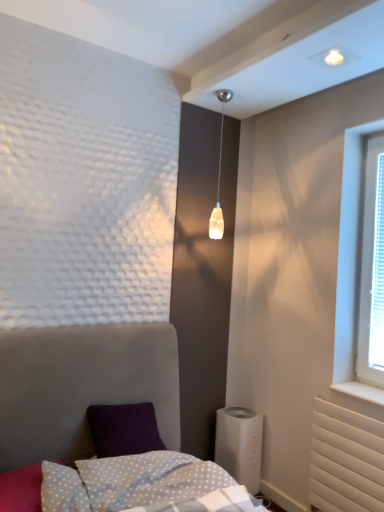
Question: Can you confirm if white dotted fabric at lower center is positioned to the right of velvet grey bed at lower left?

Choices:
 (A) no
 (B) yes

Answer: (A)

Question: Can you confirm if white dotted fabric at lower center is bigger than velvet grey bed at lower left?

Choices:
 (A) no
 (B) yes

Answer: (A)

Question: Can we say white dotted fabric at lower center lies outside velvet grey bed at lower left?

Choices:
 (A) no
 (B) yes

Answer: (A)

Question: Considering the relative sizes of white dotted fabric at lower center and velvet grey bed at lower left in the image provided, is white dotted fabric at lower center taller than velvet grey bed at lower left?

Choices:
 (A) yes
 (B) no

Answer: (B)

Question: Does white dotted fabric at lower center have a lesser height compared to velvet grey bed at lower left?

Choices:
 (A) yes
 (B) no

Answer: (A)

Question: Is white dotted fabric pillow at lower left in front of or behind velvet grey bed at lower left in the image?

Choices:
 (A) behind
 (B) front

Answer: (A)

Question: From the image's perspective, is white dotted fabric pillow at lower left located above or below velvet grey bed at lower left?

Choices:
 (A) above
 (B) below

Answer: (B)

Question: Is white dotted fabric pillow at lower left inside or outside of velvet grey bed at lower left?

Choices:
 (A) outside
 (B) inside

Answer: (B)

Question: In the image, is white dotted fabric pillow at lower left on the left side or the right side of velvet grey bed at lower left?

Choices:
 (A) right
 (B) left

Answer: (B)

Question: Considering the positions of velvet grey bed at lower left and white dotted fabric at lower center in the image, is velvet grey bed at lower left wider or thinner than white dotted fabric at lower center?

Choices:
 (A) thin
 (B) wide

Answer: (B)

Question: Is point (135, 369) closer or farther from the camera than point (77, 478)?

Choices:
 (A) closer
 (B) farther

Answer: (B)

Question: From the image's perspective, is velvet grey bed at lower left above or below white dotted fabric at lower center?

Choices:
 (A) below
 (B) above

Answer: (B)

Question: Considering the positions of velvet grey bed at lower left and white dotted fabric at lower center in the image, is velvet grey bed at lower left bigger or smaller than white dotted fabric at lower center?

Choices:
 (A) small
 (B) big

Answer: (B)

Question: Considering the positions of white dotted fabric pillow at lower left and white plastic humidifier at lower right in the image, is white dotted fabric pillow at lower left wider or thinner than white plastic humidifier at lower right?

Choices:
 (A) wide
 (B) thin

Answer: (A)

Question: From the image's perspective, is white dotted fabric pillow at lower left positioned above or below white plastic humidifier at lower right?

Choices:
 (A) above
 (B) below

Answer: (A)